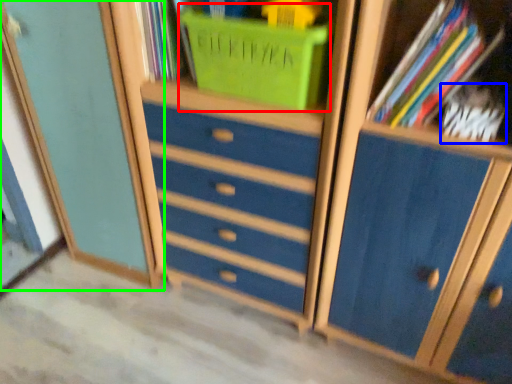
Question: Which object is positioned closest to basket (highlighted by a red box)? Select from book (highlighted by a blue box) and cupboard (highlighted by a green box).

Choices:
 (A) book
 (B) cupboard

Answer: (A)